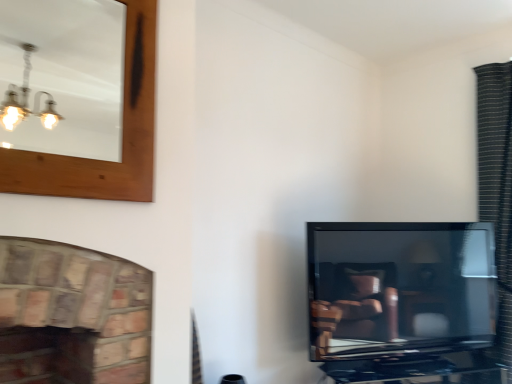
Question: Does matte black tv at right have a larger size compared to wooden-framed mirror at upper left?

Choices:
 (A) no
 (B) yes

Answer: (B)

Question: Considering the relative sizes of matte black tv at right and wooden-framed mirror at upper left in the image provided, is matte black tv at right taller than wooden-framed mirror at upper left?

Choices:
 (A) no
 (B) yes

Answer: (B)

Question: Considering the relative sizes of matte black tv at right and wooden-framed mirror at upper left in the image provided, is matte black tv at right shorter than wooden-framed mirror at upper left?

Choices:
 (A) yes
 (B) no

Answer: (B)

Question: Does matte black tv at right have a lesser width compared to wooden-framed mirror at upper left?

Choices:
 (A) yes
 (B) no

Answer: (B)

Question: Considering the relative positions of matte black tv at right and wooden-framed mirror at upper left in the image provided, is matte black tv at right in front of wooden-framed mirror at upper left?

Choices:
 (A) yes
 (B) no

Answer: (B)

Question: From a real-world perspective, is matte black tv at right physically located above or below wooden-framed mirror at upper left?

Choices:
 (A) above
 (B) below

Answer: (B)

Question: From the image's perspective, is matte black tv at right located above or below wooden-framed mirror at upper left?

Choices:
 (A) above
 (B) below

Answer: (B)

Question: Would you say matte black tv at right is inside or outside wooden-framed mirror at upper left?

Choices:
 (A) inside
 (B) outside

Answer: (B)

Question: Based on their positions, is matte black tv at right located to the left or right of wooden-framed mirror at upper left?

Choices:
 (A) left
 (B) right

Answer: (B)

Question: Is matte black tv at right in front of or behind black textured curtain at right in the image?

Choices:
 (A) front
 (B) behind

Answer: (A)

Question: From a real-world perspective, relative to black textured curtain at right, is matte black tv at right vertically above or below?

Choices:
 (A) below
 (B) above

Answer: (A)

Question: In the image, is matte black tv at right on the left side or the right side of black textured curtain at right?

Choices:
 (A) right
 (B) left

Answer: (B)

Question: In terms of width, does matte black tv at right look wider or thinner when compared to black textured curtain at right?

Choices:
 (A) thin
 (B) wide

Answer: (A)

Question: Relative to black textured curtain at right, is wooden-framed mirror at upper left in front or behind?

Choices:
 (A) behind
 (B) front

Answer: (B)

Question: Considering the positions of wooden-framed mirror at upper left and black textured curtain at right in the image, is wooden-framed mirror at upper left bigger or smaller than black textured curtain at right?

Choices:
 (A) big
 (B) small

Answer: (B)